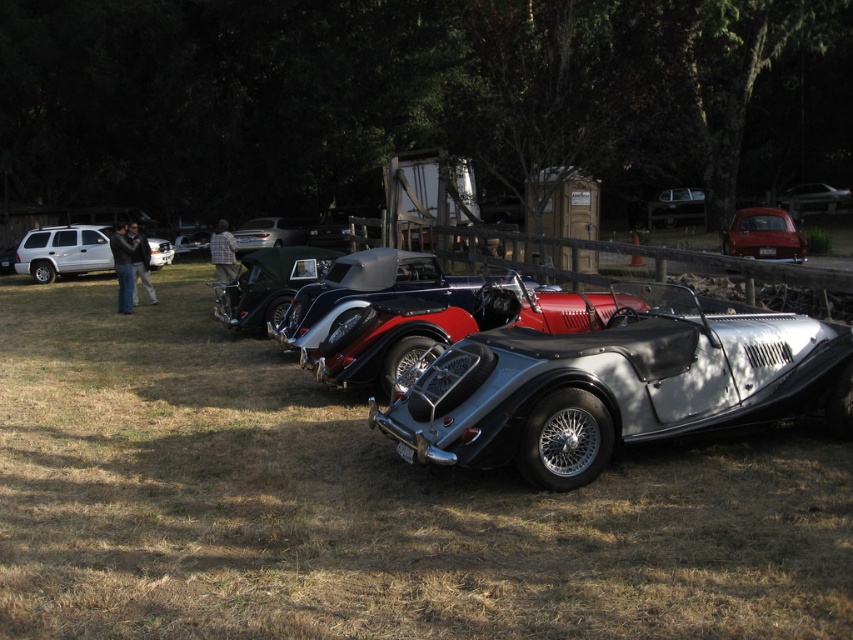
This screenshot has height=640, width=853. What do you see at coordinates (268, 234) in the screenshot? I see `shiny silver convertible at center` at bounding box center [268, 234].

Is shiny silver convertible at center above shiny silver car at center?

→ Yes, shiny silver convertible at center is above shiny silver car at center.

At what (x,y) coordinates should I click in order to perform the action: click on shiny silver convertible at center. Please return your answer as a coordinate pair (x, y). The width and height of the screenshot is (853, 640). Looking at the image, I should click on (268, 234).

Can you confirm if brown dry grass at center is wider than silver metallic convertible at center?

Yes, brown dry grass at center is wider than silver metallic convertible at center.

Can you confirm if brown dry grass at center is shorter than silver metallic convertible at center?

Yes.

Is point (741, 461) behind point (660, 355)?

Yes, point (741, 461) is farther from viewer.

Where is `brown dry grass at center`? The height and width of the screenshot is (640, 853). brown dry grass at center is located at coordinates (363, 504).

Between point (660, 202) and point (152, 260), which one is positioned in front?

Positioned in front is point (152, 260).

Is point (698, 205) in front of point (169, 243)?

No, (698, 205) is further to viewer.

The width and height of the screenshot is (853, 640). What are the coordinates of `metallic silver car at center` in the screenshot? It's located at (677, 208).